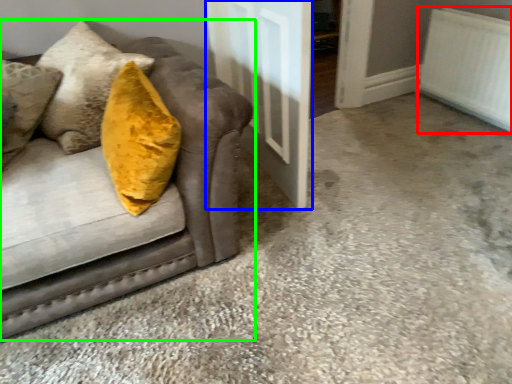
Question: Considering the real-world distances, which object is farthest from radiator (highlighted by a red box)? door (highlighted by a blue box) or studio couch (highlighted by a green box)?

Choices:
 (A) door
 (B) studio couch

Answer: (B)